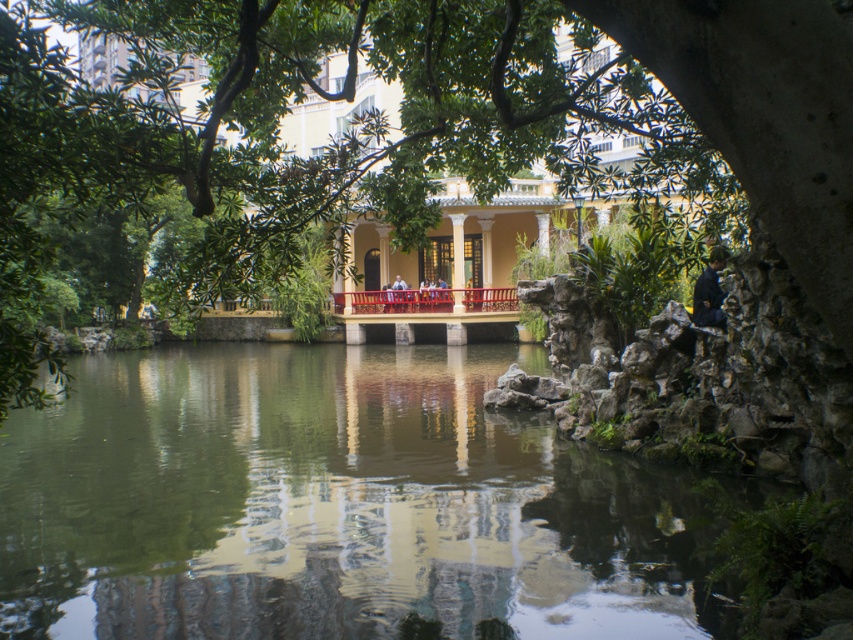
You are designing a model of this scene and need to ensure the green reflective water at center and metallic red railing at center are scaled correctly. Which object should have a wider dimension in your model?

The green reflective water at center should have a wider dimension in the model since its width is larger than that of the metallic red railing at center according to the description.

You are standing on the elevated platform of the yellow pavilion and want to take a photo of the green reflective water at center. However, you notice the metallic red railing at center might block your view. Based on the scene description, will the railing obstruct your view of the water?

The green reflective water at center is in front of the metallic red railing at center, so the railing will not obstruct your view of the water.